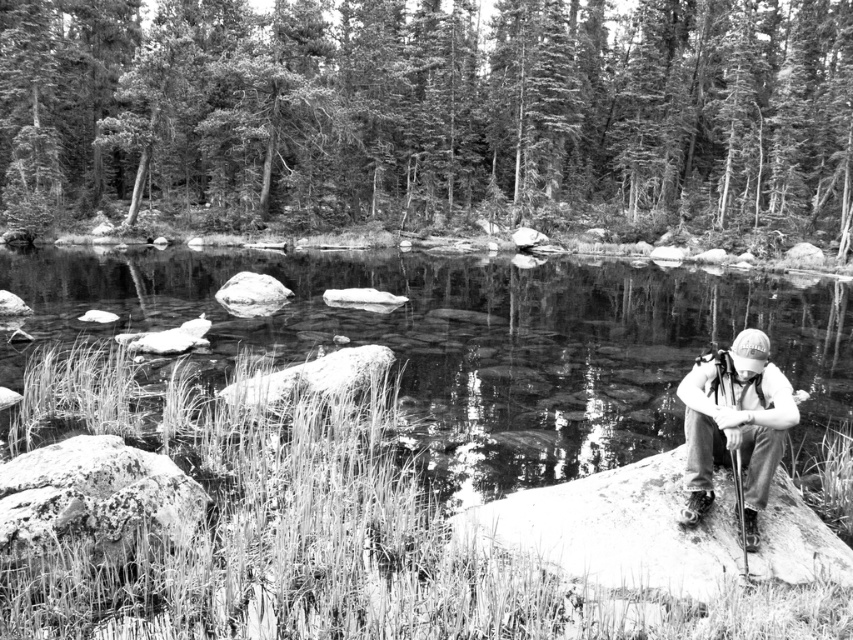
Looking at this image, can you confirm if clear water at center is wider than smooth granite boulder at right?

Correct, the width of clear water at center exceeds that of smooth granite boulder at right.

From the picture: Is the position of clear water at center more distant than that of smooth granite boulder at right?

Yes, it is behind smooth granite boulder at right.

The height and width of the screenshot is (640, 853). Describe the element at coordinates (477, 346) in the screenshot. I see `clear water at center` at that location.

Locate an element on the screen. The image size is (853, 640). clear water at center is located at coordinates (477, 346).

Does point (668, 480) come farther from viewer compared to point (740, 419)?

Yes, point (668, 480) is farther from viewer.

From the picture: Between smooth granite boulder at right and white fabric cap at right, which one appears on the right side from the viewer's perspective?

white fabric cap at right

Which is behind, point (723, 570) or point (735, 342)?

The point (735, 342) is behind.

Image resolution: width=853 pixels, height=640 pixels. I want to click on smooth granite boulder at right, so click(614, 529).

Describe the element at coordinates (477, 346) in the screenshot. Image resolution: width=853 pixels, height=640 pixels. I see `clear water at center` at that location.

At what (x,y) coordinates should I click in order to perform the action: click on clear water at center. Please return your answer as a coordinate pair (x, y). Looking at the image, I should click on (477, 346).